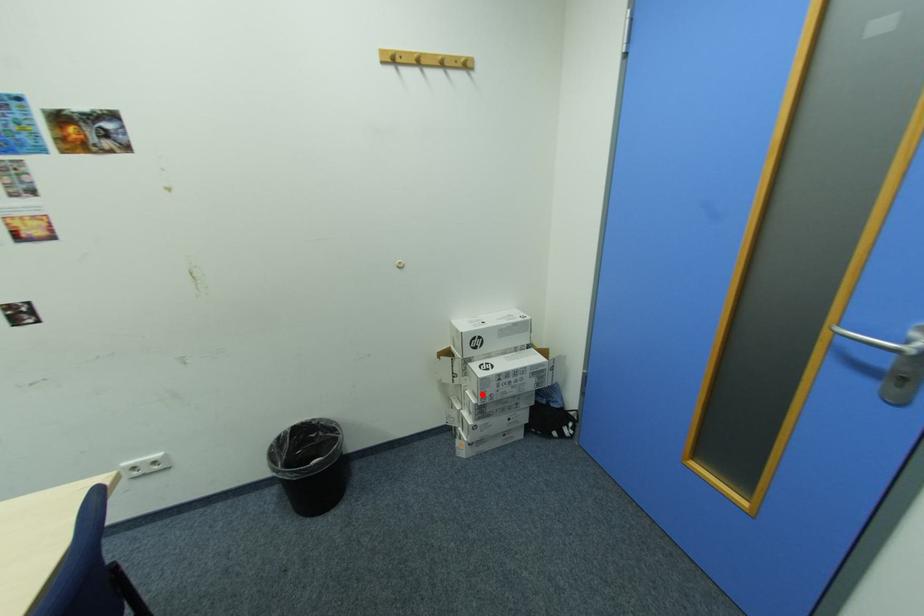
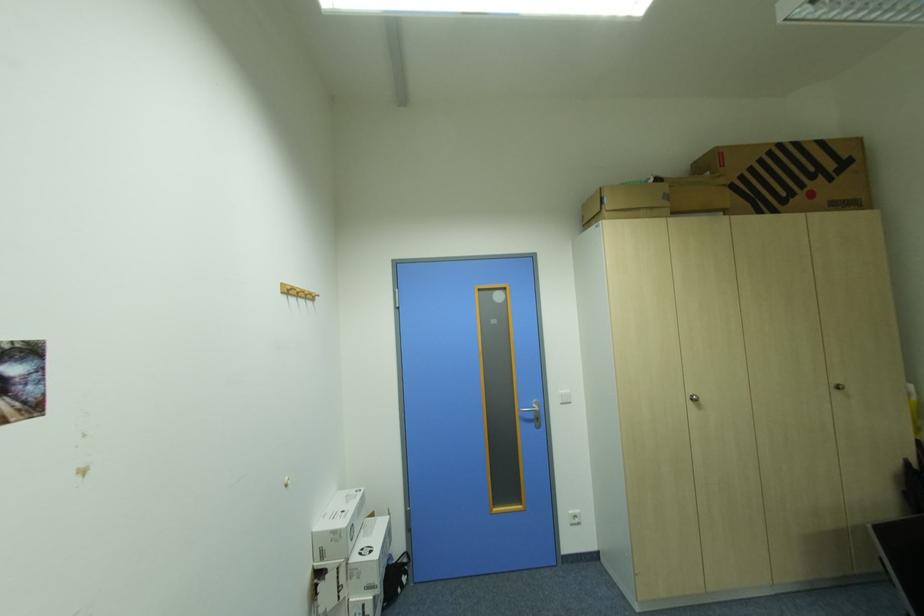
Question: I am providing you with two images of the same scene from different viewpoints. Given a red point in image1, look at the same physical point in image2. Is it:

Choices:
 (A) Closer to the viewpoint
 (B) Farther from the viewpoint

Answer: (A)